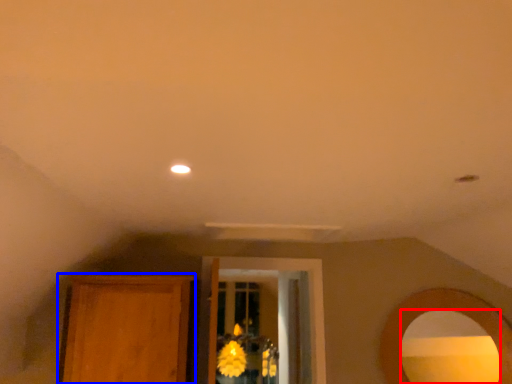
Question: Which point is further to the camera, mirror (highlighted by a red box) or armoire (highlighted by a blue box)?

Choices:
 (A) mirror
 (B) armoire

Answer: (B)